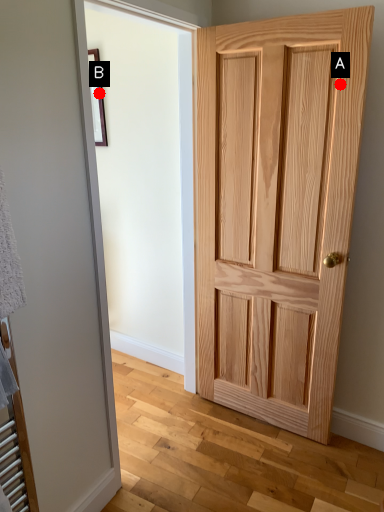
Question: Two points are circled on the image, labeled by A and B beside each circle. Which point appears closest to the camera in this image?

Choices:
 (A) A is closer
 (B) B is closer

Answer: (A)